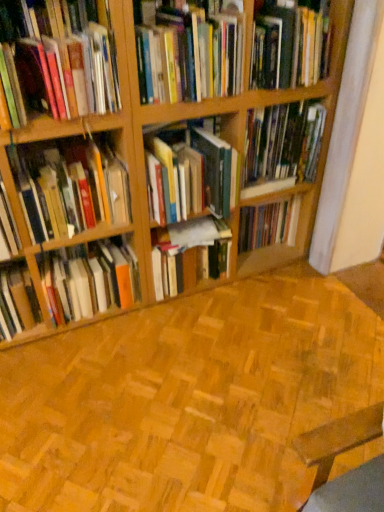
Question: Is hardcover book at center, which is the 3th book in bottom-to-top order, spatially inside hardcover book at center, which appears as the second book when ordered from the bottom, or outside of it?

Choices:
 (A) inside
 (B) outside

Answer: (B)

Question: Is point (248, 243) positioned closer to the camera than point (225, 271)?

Choices:
 (A) farther
 (B) closer

Answer: (A)

Question: Estimate the real-world distances between objects in this image. Which object is farther from the hardcover books at center, arranged as the fifth book when ordered from the bottom?

Choices:
 (A) hardcover book at upper center, positioned as the second book in top-to-bottom order
 (B) hardcover book at upper right, acting as the 9th book starting from the bottom
 (C) hardcover books at center, the 1th book positioned from the bottom
 (D) matte hardcover books at upper left, which ranks as the third book in top-to-bottom order
 (E) hardcover book at center, which is the 7th book from top to bottom

Answer: (E)

Question: Which object is the farthest from the matte hardcover books at upper left, which ranks as the third book in top-to-bottom order?

Choices:
 (A) hardcover book at upper right, acting as the 9th book starting from the bottom
 (B) hardcover books at left, the sixth book positioned from the top
 (C) hardcover books at center, which is the 6th book in bottom-to-top order
 (D) wooden parquet flooring at center
 (E) hardcover book at upper center, positioned as the second book in top-to-bottom order

Answer: (D)